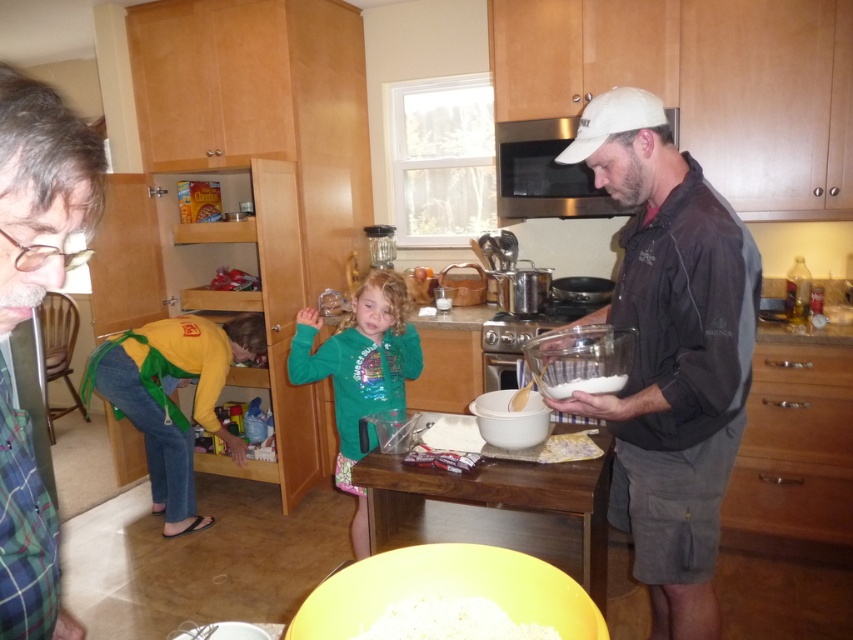
In the kitchen scene, there are two people involved in cooking activities. One is holding a glass bowl with a white substance and a wooden spoon, and the other is wearing glasses. The scene also includes a yellow mixing bowl on the floor. Where is the point at coordinate (41, 189) located?

The point at coordinate (41, 189) is located on the green plaid shirt at left.

You are a drone operator trying to capture a closeup of the two points in the kitchen scene. The first point is at coordinate point (10, 173) and the second is at point (520, 570). Which point should you adjust your drone to focus on first to ensure it captures the closest point to the camera?

Point (10, 173) is closer to the camera than point (520, 570), so you should focus on point (10, 173) first.

You are standing in the kitchen and want to reach the flour in the yellow mixing bowl on the floor. There are two points marked in the scene. One is at point (387, 586) and the other at point (601, 387). Which point should you move towards to get closer to the yellow mixing bowl on the floor?

Point (387, 586) is in front of point (601, 387), so you should move towards point (387, 586) to get closer to the yellow mixing bowl on the floor.